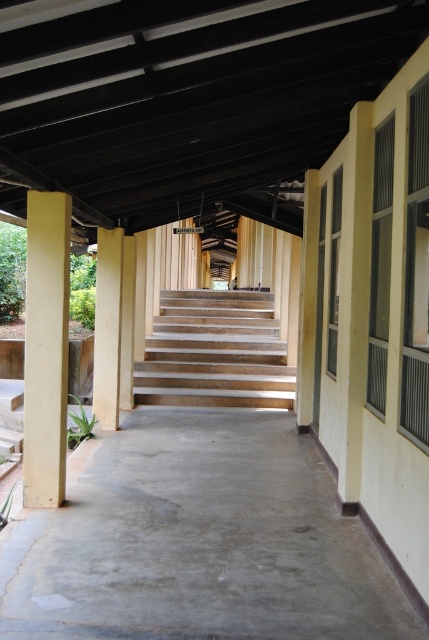
Question: Is the position of gray concrete floor at center more distant than that of beige concrete pillar at left?

Choices:
 (A) no
 (B) yes

Answer: (A)

Question: Which of these objects is positioned farthest from the gray concrete floor at center?

Choices:
 (A) light yellow wood pillar at center
 (B) beige concrete pillar at left

Answer: (A)

Question: Does wooden stairs at center come behind beige concrete pillar at left?

Choices:
 (A) yes
 (B) no

Answer: (A)

Question: Which point is closer to the camera?

Choices:
 (A) (357, 632)
 (B) (238, 310)

Answer: (A)

Question: From the image, what is the correct spatial relationship of gray concrete floor at center in relation to beige concrete pillar at left?

Choices:
 (A) above
 (B) below

Answer: (B)

Question: Which object is farther from the camera taking this photo?

Choices:
 (A) wooden stairs at center
 (B) beige concrete pillar at left
 (C) light yellow wood pillar at center

Answer: (A)